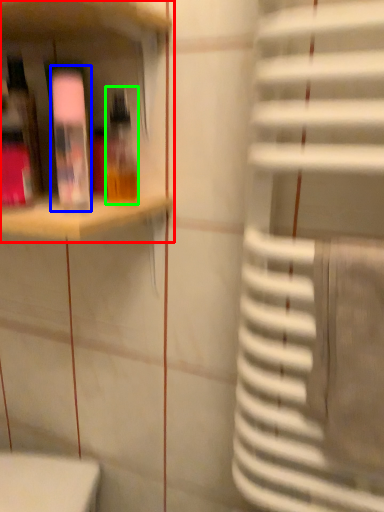
Question: Which is farther away from shelf (highlighted by a red box)? bottle (highlighted by a blue box) or bottle (highlighted by a green box)?

Choices:
 (A) bottle
 (B) bottle

Answer: (B)